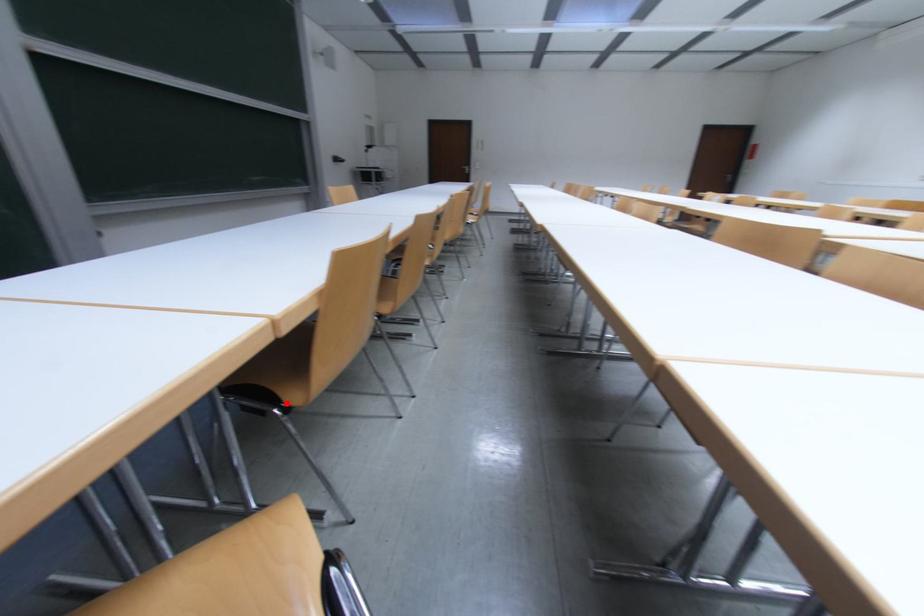
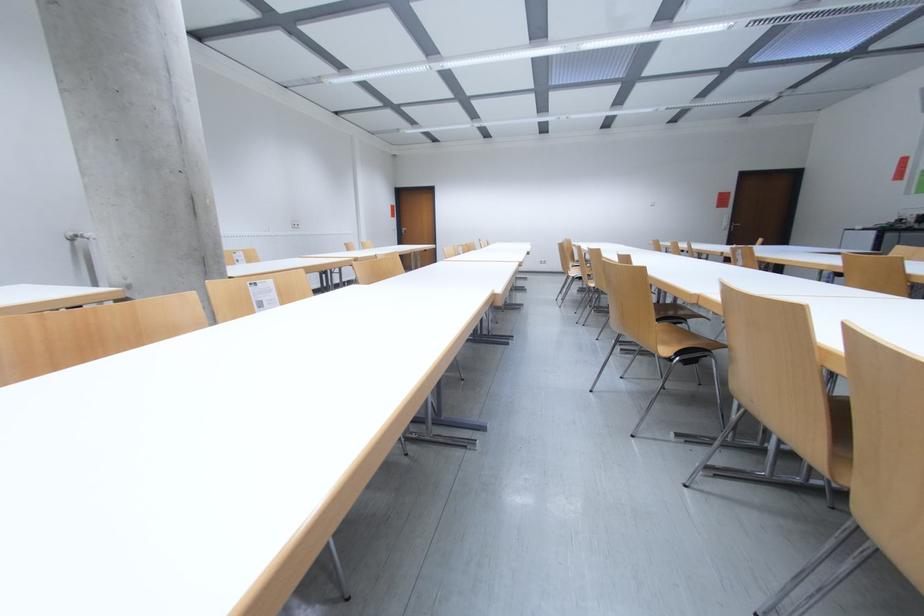
Question: I am providing you with two images of the same scene from different viewpoints. A red point is marked on the first image. Is the red point's position out of view in image 2?

Choices:
 (A) Yes
 (B) No

Answer: (A)